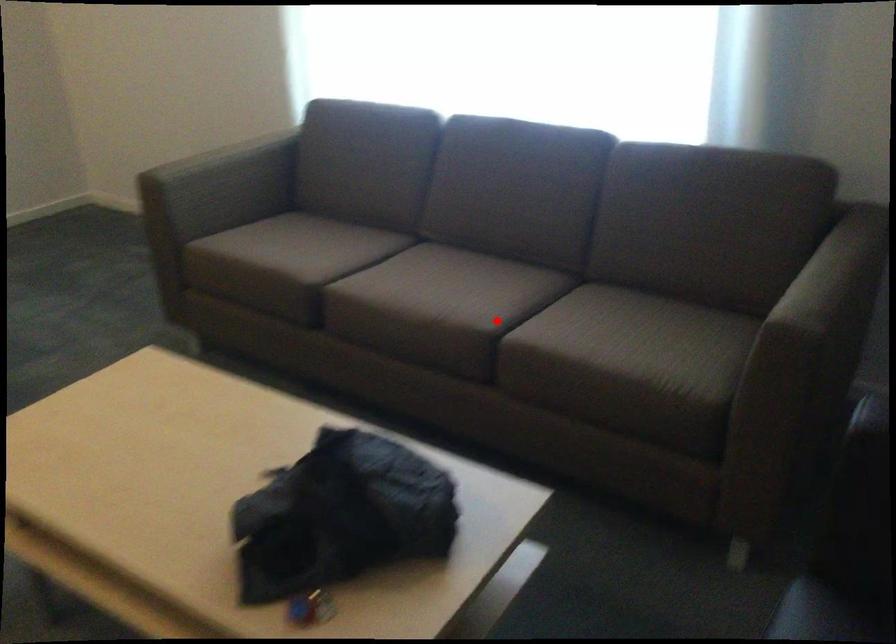
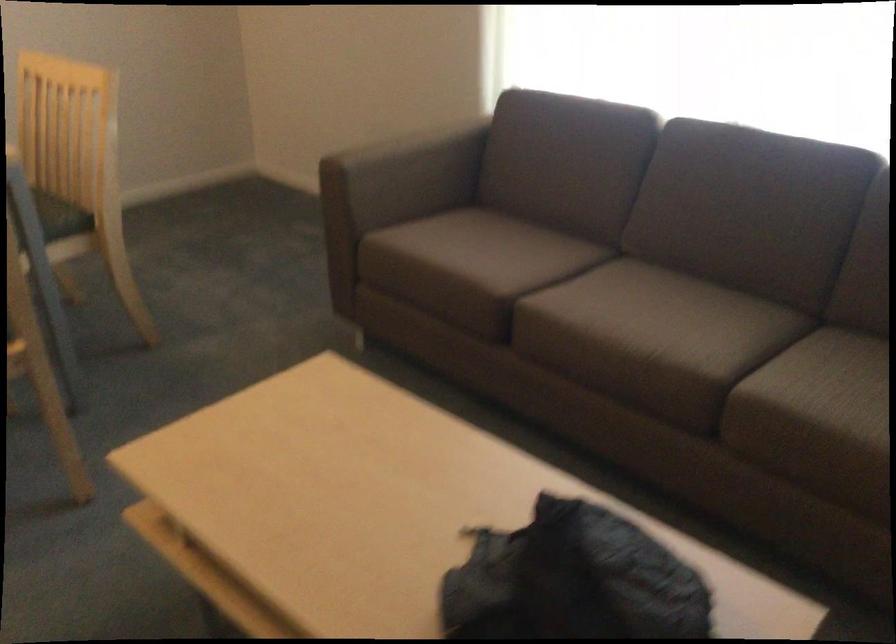
The point at the highlighted location is marked in the first image. Where is the corresponding point in the second image?

(726, 368)